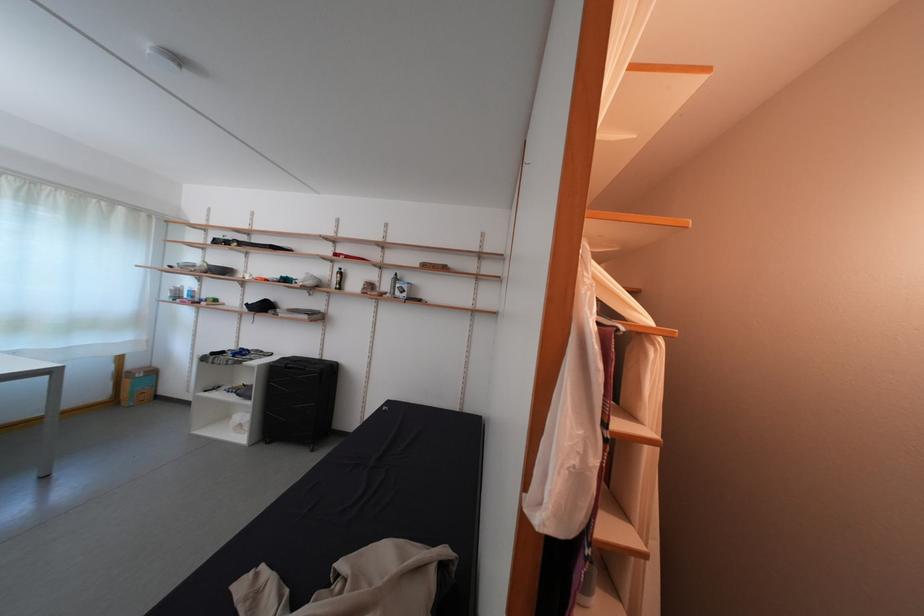
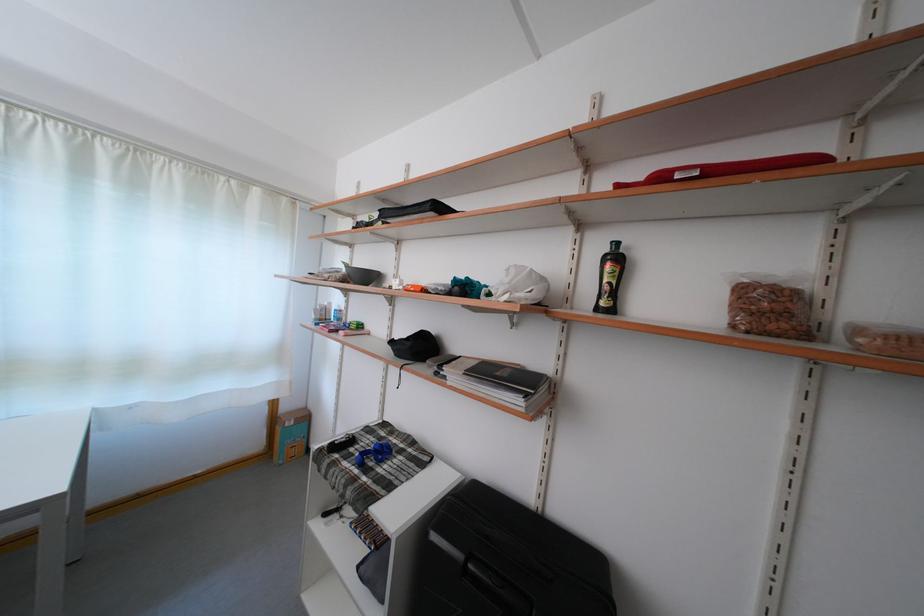
In the second image, find the point that corresponds to the point at 200,378 in the first image.

(344, 436)